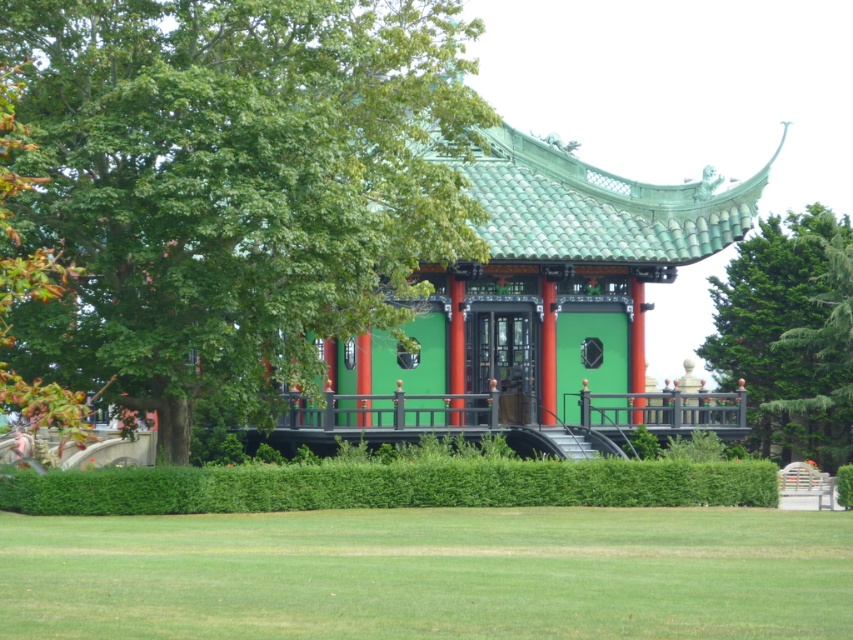
You are standing at the center of the garden and want to take a photo of the green leafy tree at upper left. Which direction should you face to capture it in the frame?

You should face the upper left direction to capture the green leafy tree at upper left in the frame since it is located at point coordinates of (233, 188).

You are standing at the entrance of the pavilion and want to locate the green leafy tree at upper left. According to the coordinates provided, where should you look relative to your position?

The green leafy tree at upper left is located at coordinates 0.294 on the x axis and 0.274 on the y axis, which corresponds to the upper left area of the image. Since you are at the entrance, you should look towards the upper left direction from your current position to find the tree.

You are standing at the entrance of the pavilion and see two points marked in the garden. The first point is labeled as point (22,29) and the second is point (798,236). Which point is closer to you?

Point (22,29) is in front of point (798,236), so it is closer to you.